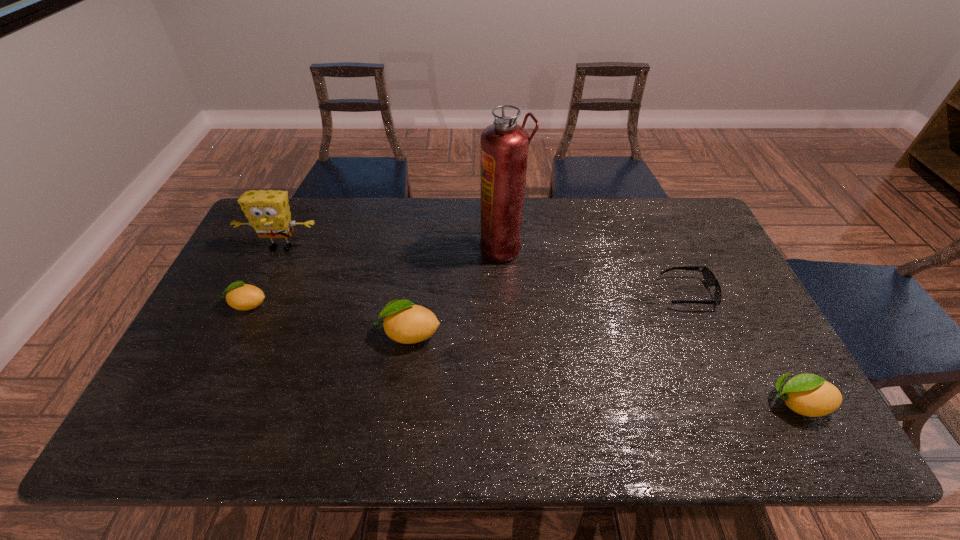
To achieve even spacing by inserting another lemon among them, please point to a vacant spot for this new lemon. Please provide its 2D coordinates. Your answer should be formatted as a tuple, i.e. [(x, y)], where the tuple contains the x and y coordinates of a point satisfying the conditions above.

[(590, 366)]